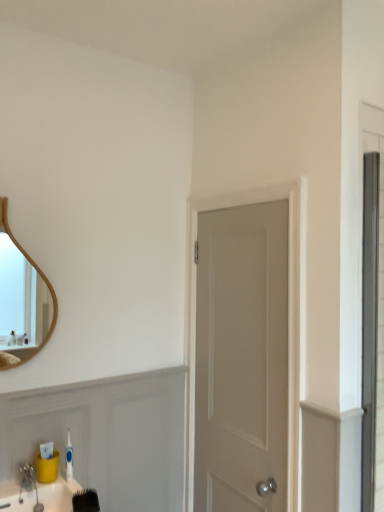
Question: Would you say white matte door at center contains black bristle brush at lower left?

Choices:
 (A) no
 (B) yes

Answer: (A)

Question: From a real-world perspective, is white matte door at center on top of black bristle brush at lower left?

Choices:
 (A) yes
 (B) no

Answer: (A)

Question: Is white matte door at center to the right of black bristle brush at lower left from the viewer's perspective?

Choices:
 (A) no
 (B) yes

Answer: (B)

Question: Is white matte door at center located outside black bristle brush at lower left?

Choices:
 (A) yes
 (B) no

Answer: (A)

Question: Is white matte door at center oriented towards black bristle brush at lower left?

Choices:
 (A) yes
 (B) no

Answer: (A)

Question: From the image's perspective, is white matte door at center located beneath black bristle brush at lower left?

Choices:
 (A) yes
 (B) no

Answer: (B)

Question: Can you confirm if black bristle brush at lower left is wider than brushed metal faucet at lower left?

Choices:
 (A) yes
 (B) no

Answer: (A)

Question: Considering the relative sizes of black bristle brush at lower left and brushed metal faucet at lower left in the image provided, is black bristle brush at lower left smaller than brushed metal faucet at lower left?

Choices:
 (A) yes
 (B) no

Answer: (B)

Question: Can you confirm if black bristle brush at lower left is thinner than brushed metal faucet at lower left?

Choices:
 (A) no
 (B) yes

Answer: (A)

Question: Is the depth of black bristle brush at lower left less than that of brushed metal faucet at lower left?

Choices:
 (A) yes
 (B) no

Answer: (A)

Question: Is black bristle brush at lower left taller than brushed metal faucet at lower left?

Choices:
 (A) yes
 (B) no

Answer: (B)

Question: Does black bristle brush at lower left have a larger size compared to brushed metal faucet at lower left?

Choices:
 (A) yes
 (B) no

Answer: (A)

Question: Does wooden mirror at upper left turn towards black bristle brush at lower left?

Choices:
 (A) no
 (B) yes

Answer: (A)